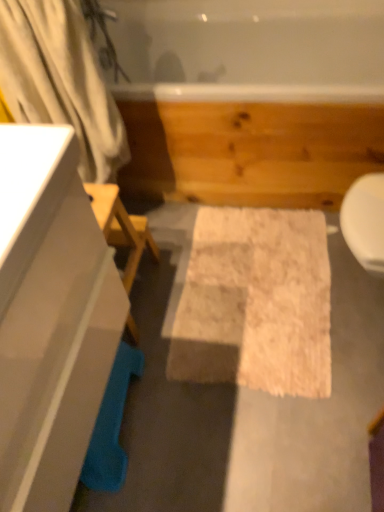
Question: Does white fabric shower curtain at left come in front of white fluffy bath mat at center?

Choices:
 (A) yes
 (B) no

Answer: (A)

Question: From a real-world perspective, is white fabric shower curtain at left over white fluffy bath mat at center?

Choices:
 (A) no
 (B) yes

Answer: (B)

Question: Can you confirm if white fabric shower curtain at left is smaller than white fluffy bath mat at center?

Choices:
 (A) no
 (B) yes

Answer: (A)

Question: Can you confirm if white fabric shower curtain at left is shorter than white fluffy bath mat at center?

Choices:
 (A) no
 (B) yes

Answer: (A)

Question: Considering the relative positions of white fabric shower curtain at left and white fluffy bath mat at center in the image provided, is white fabric shower curtain at left to the left of white fluffy bath mat at center from the viewer's perspective?

Choices:
 (A) yes
 (B) no

Answer: (A)

Question: Is white fabric shower curtain at left far from white fluffy bath mat at center?

Choices:
 (A) yes
 (B) no

Answer: (B)

Question: From the image's perspective, is white glossy cabinet at left under white fluffy bath mat at center?

Choices:
 (A) yes
 (B) no

Answer: (A)

Question: From a real-world perspective, is white glossy cabinet at left below white fluffy bath mat at center?

Choices:
 (A) yes
 (B) no

Answer: (B)

Question: Does white glossy cabinet at left have a greater width compared to white fluffy bath mat at center?

Choices:
 (A) no
 (B) yes

Answer: (A)

Question: Does white glossy cabinet at left have a lesser width compared to white fluffy bath mat at center?

Choices:
 (A) no
 (B) yes

Answer: (B)

Question: Can we say white glossy cabinet at left lies outside white fluffy bath mat at center?

Choices:
 (A) yes
 (B) no

Answer: (A)

Question: Is white glossy cabinet at left shorter than white fluffy bath mat at center?

Choices:
 (A) no
 (B) yes

Answer: (A)

Question: Could white glossy cabinet at left be considered to be inside white fluffy bath mat at center?

Choices:
 (A) no
 (B) yes

Answer: (A)